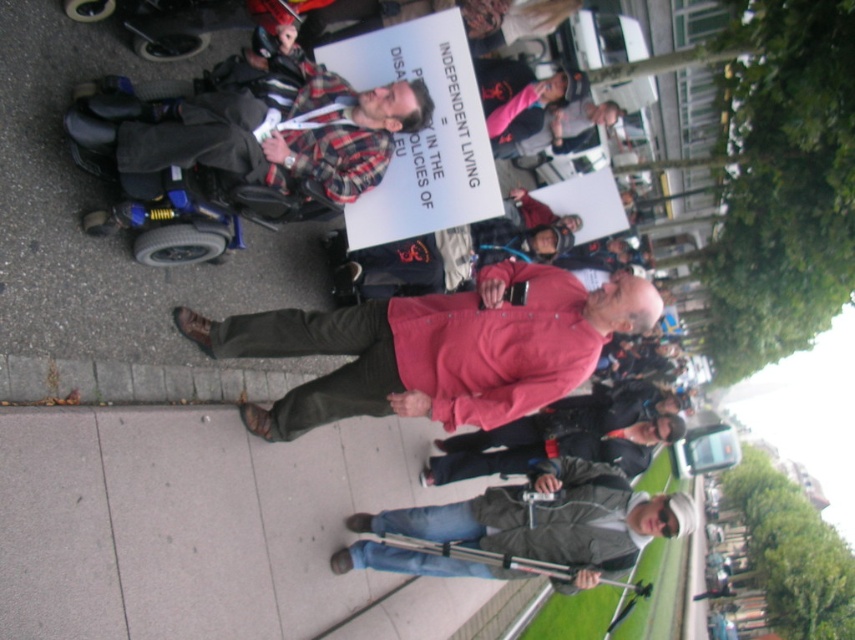
Question: Which point is farther to the camera?

Choices:
 (A) (331, 140)
 (B) (113, 541)
 (C) (523, 266)

Answer: (C)

Question: Can you confirm if gray concrete sidewalk at lower left is bigger than denim jeans at lower center?

Choices:
 (A) no
 (B) yes

Answer: (B)

Question: Which point is farther from the camera taking this photo?

Choices:
 (A) [30, 467]
 (B) [193, 97]
 (C) [535, 372]
 (D) [629, 490]

Answer: (D)

Question: Which of these objects is positioned closest to the plaid fabric shirt at center?

Choices:
 (A) red cotton shirt at center
 (B) gray concrete sidewalk at lower left
 (C) denim jeans at lower center

Answer: (A)

Question: Does gray concrete sidewalk at lower left have a greater width compared to red cotton shirt at center?

Choices:
 (A) no
 (B) yes

Answer: (A)

Question: Does gray concrete sidewalk at lower left lie behind red cotton shirt at center?

Choices:
 (A) yes
 (B) no

Answer: (B)